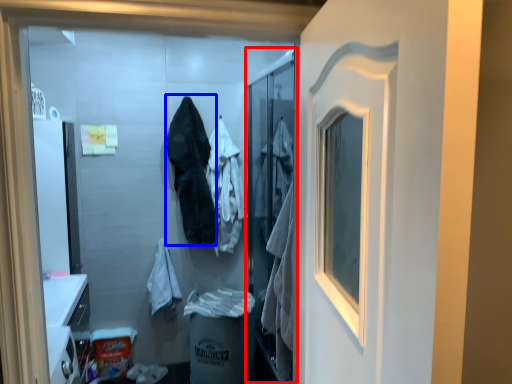
Question: Which of the following is the farthest to the observer, screen door (highlighted by a red box) or clothing (highlighted by a blue box)?

Choices:
 (A) screen door
 (B) clothing

Answer: (B)